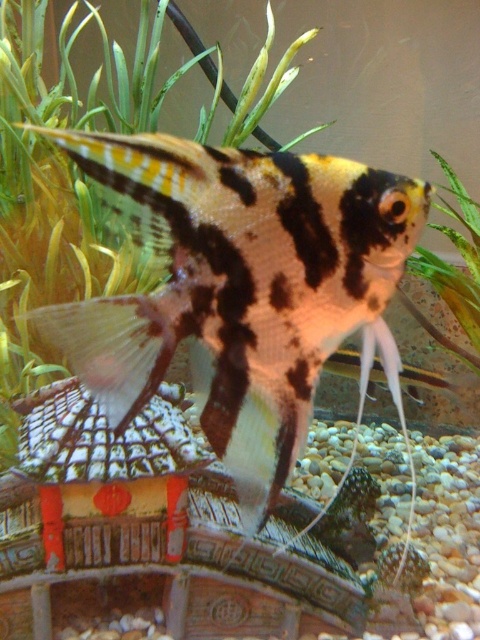
Question: Which object is closer to the camera taking this photo?

Choices:
 (A) black and white striped fish at center
 (B) green leafy plant at center

Answer: (A)

Question: Can you confirm if black and white striped fish at center is bigger than green leafy plant at center?

Choices:
 (A) yes
 (B) no

Answer: (B)

Question: Which of the following is the closest to the observer?

Choices:
 (A) [456, 236]
 (B) [276, 458]

Answer: (B)

Question: Does black and white striped fish at center come in front of green leafy plant at center?

Choices:
 (A) no
 (B) yes

Answer: (B)

Question: Which object is closer to the camera taking this photo?

Choices:
 (A) black and white striped fish at center
 (B) green leafy plant at center

Answer: (A)

Question: Can you confirm if black and white striped fish at center is positioned above green leafy plant at center?

Choices:
 (A) no
 (B) yes

Answer: (A)